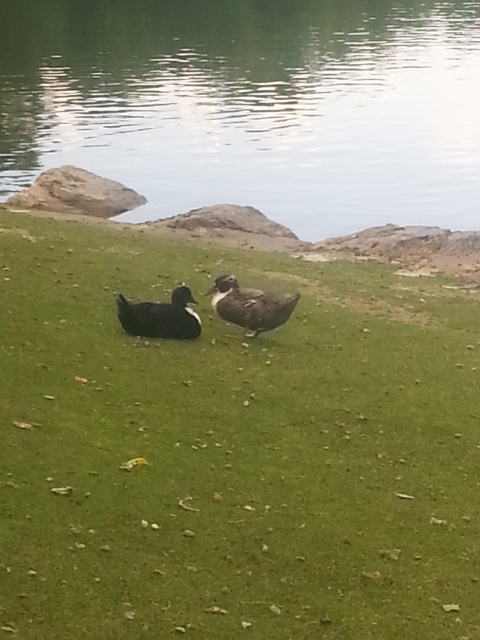
Question: Which of the following is the closest to the observer?

Choices:
 (A) (224, 166)
 (B) (176, 296)
 (C) (349, 625)
 (D) (264, 317)

Answer: (C)

Question: Among these objects, which one is farthest from the camera?

Choices:
 (A) green smooth water at center
 (B) black matte duck at center
 (C) green grassy at center
 (D) brown matte duck at center

Answer: (A)

Question: Can you confirm if green smooth water at center is thinner than brown matte duck at center?

Choices:
 (A) no
 (B) yes

Answer: (A)

Question: Which is farther from the green grassy at center?

Choices:
 (A) brown matte duck at center
 (B) black matte duck at center
 (C) green smooth water at center

Answer: (C)

Question: Does green grassy at center have a greater width compared to brown matte duck at center?

Choices:
 (A) yes
 (B) no

Answer: (A)

Question: Is green grassy at center to the left of brown matte duck at center from the viewer's perspective?

Choices:
 (A) yes
 (B) no

Answer: (B)